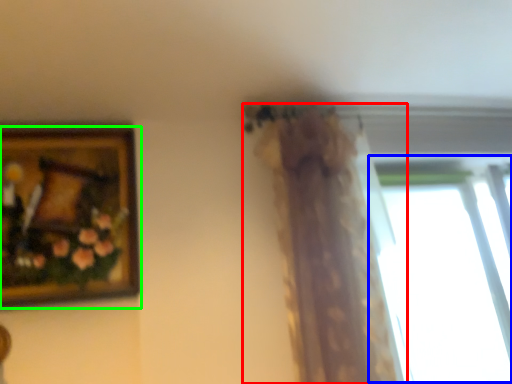
Question: Estimate the real-world distances between objects in this image. Which object is farther from curtain (highlighted by a red box), window (highlighted by a blue box) or picture frame (highlighted by a green box)?

Choices:
 (A) window
 (B) picture frame

Answer: (A)